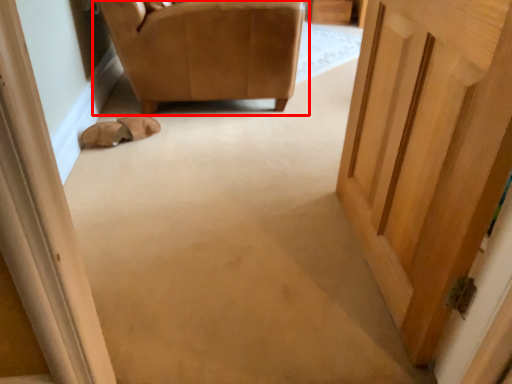
Question: Considering the relative positions of chair (annotated by the red box) and shoe in the image provided, where is chair (annotated by the red box) located with respect to the staircase?

Choices:
 (A) right
 (B) left

Answer: (A)